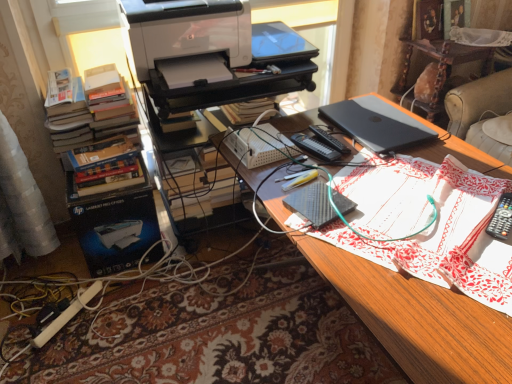
Measure the distance between white plastic printer at upper center, positioned as the 1th computer desk in left-to-right order, and camera.

white plastic printer at upper center, positioned as the 1th computer desk in left-to-right order, and camera are 4.55 feet apart.

Describe the element at coordinates (501, 218) in the screenshot. This screenshot has height=384, width=512. I see `black plastic remote control at right` at that location.

What is the approximate height of black matte laptop at upper right?

black matte laptop at upper right is 1.14 inches tall.

This screenshot has width=512, height=384. What are the coordinates of `hardcover books at left` in the screenshot? It's located at (105, 147).

Locate an element on the screen. This screenshot has height=384, width=512. white plastic printer at upper center, positioned as the 1th computer desk in left-to-right order is located at coordinates (234, 84).

In the scene shown: From a real-world perspective, is white matte printer at upper left physically located above or below black textured notebook at center?

Clearly, from a real-world perspective, white matte printer at upper left is above black textured notebook at center.

Do you think white matte printer at upper left is within black textured notebook at center, or outside of it?

white matte printer at upper left is not inside black textured notebook at center, it's outside.

Considering the positions of objects white matte printer at upper left and black textured notebook at center in the image provided, who is behind, white matte printer at upper left or black textured notebook at center?

white matte printer at upper left is more distant.

Looking at this image, based on their sizes in the image, would you say black matte laptop at upper right is bigger or smaller than wooden desk at center?

In the image, black matte laptop at upper right appears to be smaller than wooden desk at center.

From a real-world perspective, is black matte laptop at upper right physically located above or below wooden desk at center?

black matte laptop at upper right is above wooden desk at center.

Is the depth of black matte laptop at upper right greater than that of wooden desk at center?

Yes.

Does black matte laptop at upper right touch wooden desk at center?

No, black matte laptop at upper right is not in contact with wooden desk at center.

Would you say wooden desk at center is outside black matte laptop at upper right?

Yes.

Considering the positions of objects wooden desk at center and black matte laptop at upper right in the image provided, who is more to the right, wooden desk at center or black matte laptop at upper right?

From the viewer's perspective, black matte laptop at upper right appears more on the right side.

Which of these two, wooden desk at center or black matte laptop at upper right, is bigger?

Bigger between the two is wooden desk at center.

Are wooden desk at center and black matte laptop at upper right far apart?

wooden desk at center is near black matte laptop at upper right, not far away.

Does wooden desk at center have a larger size compared to beige leather couch at upper right?

Correct, wooden desk at center is larger in size than beige leather couch at upper right.

You are a GUI agent. You are given a task and a screenshot of the screen. Output one action in this format:
    pyautogui.click(x=<x>, y=<y>)
    Task: Click on the studio couch that appears on the right of wooden desk at center
    This screenshot has height=384, width=512.
    Given the screenshot: What is the action you would take?
    pyautogui.click(x=484, y=114)

Considering the sizes of objects wooden desk at center and beige leather couch at upper right in the image provided, who is thinner, wooden desk at center or beige leather couch at upper right?

With smaller width is beige leather couch at upper right.

In terms of height, does wooden desk at center look taller or shorter compared to beige leather couch at upper right?

Considering their sizes, wooden desk at center has less height than beige leather couch at upper right.

The width and height of the screenshot is (512, 384). I want to click on desk on the right of black textured notebook at center, so click(x=418, y=319).

Is wooden desk at center to the left of black textured notebook at center from the viewer's perspective?

No, wooden desk at center is not to the left of black textured notebook at center.

Looking at their sizes, would you say wooden desk at center is wider or thinner than black textured notebook at center?

wooden desk at center is wider than black textured notebook at center.

Which is behind, white matte printer at upper left or white plastic printer at upper center, acting as the second computer desk starting from the right?

Positioned behind is white plastic printer at upper center, acting as the second computer desk starting from the right.

Looking at the image, does white matte printer at upper left seem bigger or smaller compared to white plastic printer at upper center, positioned as the 1th computer desk in left-to-right order?

Considering their sizes, white matte printer at upper left takes up less space than white plastic printer at upper center, positioned as the 1th computer desk in left-to-right order.

From the image's perspective, which one is positioned higher, white matte printer at upper left or white plastic printer at upper center, acting as the second computer desk starting from the right?

white matte printer at upper left is shown above in the image.

Where is `computer desk that is the 1st one when counting backward from the white matte printer at upper left`? This screenshot has width=512, height=384. computer desk that is the 1st one when counting backward from the white matte printer at upper left is located at coordinates (234, 84).

In the scene shown: From a real-world perspective, does white plastic printer at upper center, positioned as the 1th computer desk in left-to-right order, stand above black matte laptop at upper right?

No.

Does white plastic printer at upper center, acting as the second computer desk starting from the right, have a larger size compared to black matte laptop at upper right?

Yes, white plastic printer at upper center, acting as the second computer desk starting from the right, is bigger than black matte laptop at upper right.

How many degrees apart are the facing directions of white plastic printer at upper center, positioned as the 1th computer desk in left-to-right order, and black matte laptop at upper right?

84.4 degrees.

Is white plastic printer at upper center, acting as the second computer desk starting from the right, not inside black matte laptop at upper right?

Absolutely, white plastic printer at upper center, acting as the second computer desk starting from the right, is external to black matte laptop at upper right.

The height and width of the screenshot is (384, 512). Identify the location of notebook on the right side of white matte printer at upper left. (313, 204).

Identify the location of desk in front of the black matte laptop at upper right. This screenshot has width=512, height=384. (418, 319).

When comparing their distances from white plastic printer at upper center, positioned as the 1th computer desk in left-to-right order, does black matte laptop at upper right or hardcover books at left seem further?

Among the two, black matte laptop at upper right is located further to white plastic printer at upper center, positioned as the 1th computer desk in left-to-right order.

When comparing their distances from hardcover books at left, does black plastic remote control at right or black matte laptop at upper right seem further?

black plastic remote control at right.

From the image, which object appears to be nearer to white plastic printer at upper center, acting as the second computer desk starting from the right, wooden desk at center or black matte laptop at upper right?

The object closer to white plastic printer at upper center, acting as the second computer desk starting from the right, is black matte laptop at upper right.

Which object lies nearer to the anchor point black plastic remote control at right, white plastic printer at upper center, positioned as the 1th computer desk in left-to-right order, or black plastic laptop at upper right, marked as the second computer desk in a left-to-right arrangement?

Based on the image, white plastic printer at upper center, positioned as the 1th computer desk in left-to-right order, appears to be nearer to black plastic remote control at right.

When comparing their distances from black textured notebook at center, does black plastic laptop at upper right, marked as the second computer desk in a left-to-right arrangement, or wooden desk at center seem closer?

wooden desk at center lies closer to black textured notebook at center than the other object.

When comparing their distances from beige leather couch at upper right, does hardcover books at left or black matte laptop at upper right seem closer?

black matte laptop at upper right lies closer to beige leather couch at upper right than the other object.

Based on their spatial positions, is beige leather couch at upper right or hardcover books at left closer to black textured notebook at center?

The object closer to black textured notebook at center is hardcover books at left.

Looking at the image, which one is located further to black matte laptop at upper right, black plastic remote control at right or hardcover books at left?

hardcover books at left is positioned further to the anchor black matte laptop at upper right.

Find the location of a particular element. notebook between hardcover books at left and black plastic remote control at right in the horizontal direction is located at coordinates (313, 204).

Where is `remote control between hardcover books at left and beige leather couch at upper right from left to right`? This screenshot has height=384, width=512. remote control between hardcover books at left and beige leather couch at upper right from left to right is located at coordinates (501, 218).

Where is `desk between hardcover books at left and black plastic remote control at right from left to right`? Image resolution: width=512 pixels, height=384 pixels. desk between hardcover books at left and black plastic remote control at right from left to right is located at coordinates pos(418,319).

Where is `desk located between white plastic printer at upper center, positioned as the 1th computer desk in left-to-right order, and black plastic remote control at right in the left-right direction`? desk located between white plastic printer at upper center, positioned as the 1th computer desk in left-to-right order, and black plastic remote control at right in the left-right direction is located at coordinates (418, 319).